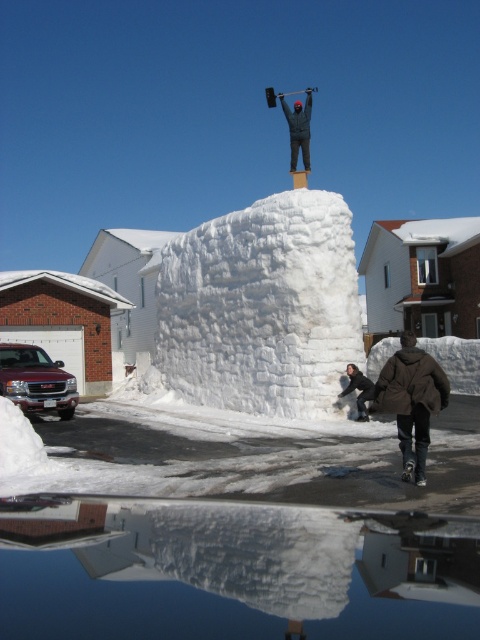
You are standing at the edge of the puddle and want to reach the dark gray jacket at center without stepping on the white snow block at center. What is the minimum distance you need to walk?

The white snow block at center is 5.12 meters away from dark gray jacket at center. To avoid stepping on the white snow block at center, you must walk around it, so the minimum distance you need to walk is greater than 5.12 meters.

You are standing in the winter scene and want to pick up the brown fuzzy coat at lower right. Where should you look to find it?

The brown fuzzy coat at lower right is located at point (410, 401).